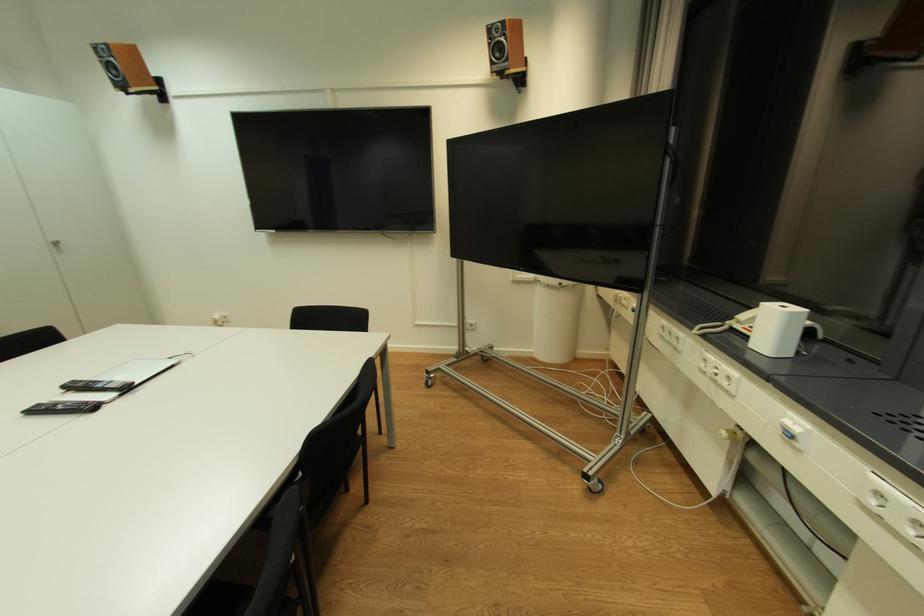
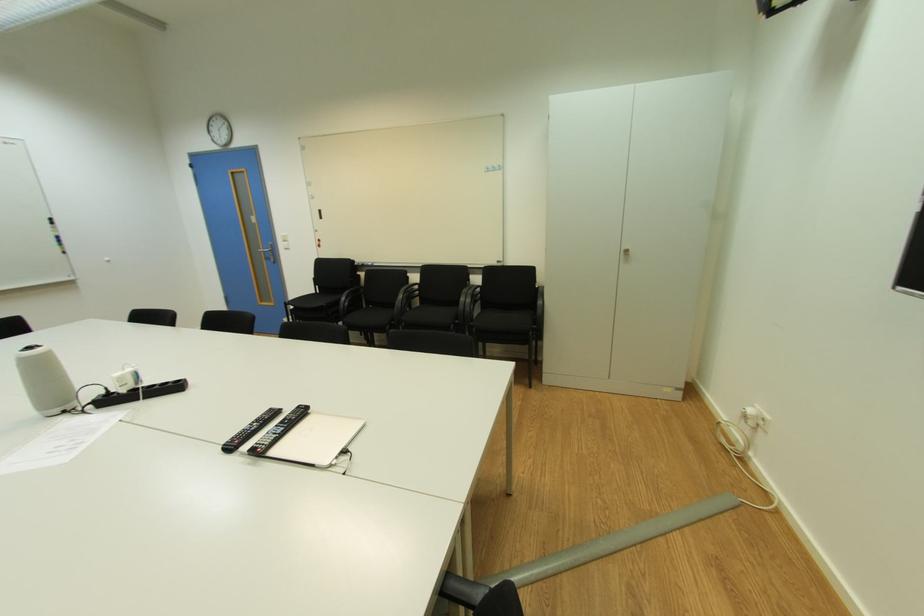
Locate, in the second image, the point that corresponds to pixel 57 246 in the first image.

(628, 254)